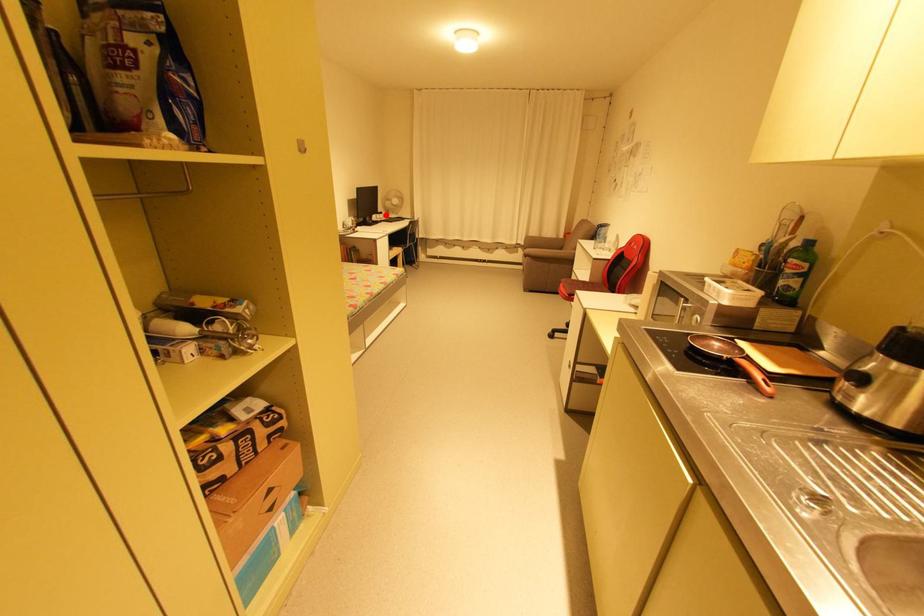
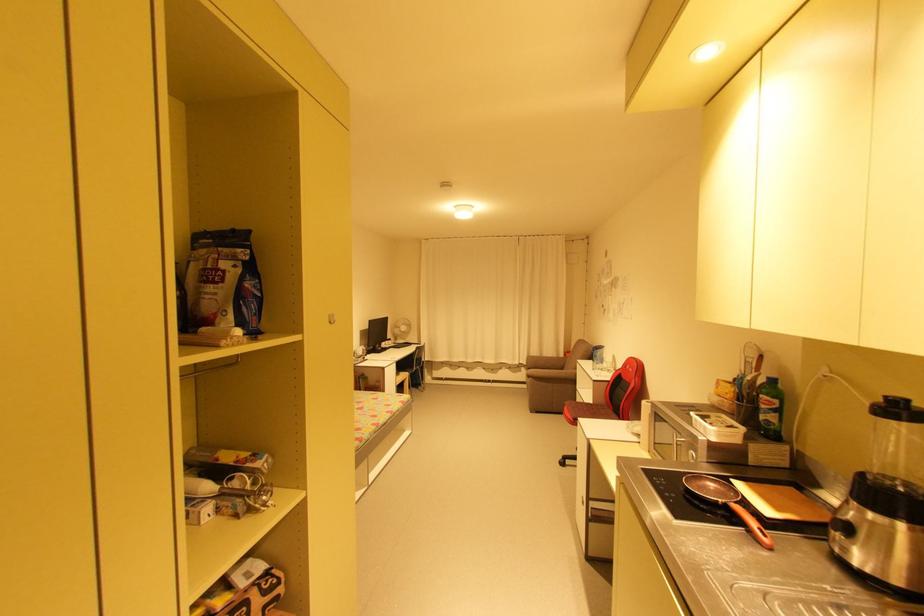
Question: A red point is marked in image1. In image2, is the corresponding 3D point closer to the camera or farther? Reply with the corresponding letter.

Choices:
 (A) The corresponding 3D point is closer.
 (B) The corresponding 3D point is farther.

Answer: (B)